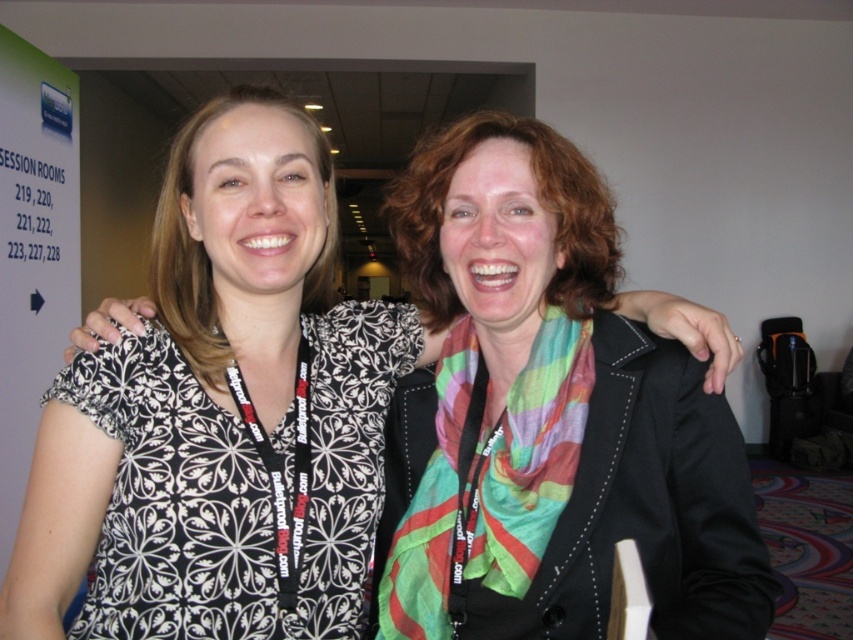
Question: Can you confirm if patterned fabric blouse at center is bigger than black printed fabric dress at left?

Choices:
 (A) yes
 (B) no

Answer: (A)

Question: Based on their relative distances, which object is nearer to the multicolored silk scarf at center?

Choices:
 (A) patterned fabric blouse at center
 (B) black printed fabric dress at left

Answer: (B)

Question: Observing the image, what is the correct spatial positioning of black printed fabric dress at left in reference to multicolored silk scarf at center?

Choices:
 (A) above
 (B) below

Answer: (A)

Question: Is the position of patterned fabric blouse at center more distant than that of multicolored silk scarf at center?

Choices:
 (A) no
 (B) yes

Answer: (A)

Question: Which object is closer to the camera taking this photo?

Choices:
 (A) patterned fabric blouse at center
 (B) multicolored silk scarf at center

Answer: (A)

Question: Estimate the real-world distances between objects in this image. Which object is closer to the black printed fabric dress at left?

Choices:
 (A) multicolored silk scarf at center
 (B) patterned fabric blouse at center

Answer: (B)